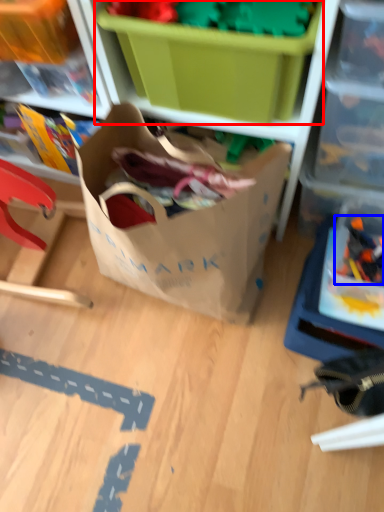
Question: Which object is closer to the camera taking this photo, storage box (highlighted by a red box) or toy (highlighted by a blue box)?

Choices:
 (A) storage box
 (B) toy

Answer: (A)